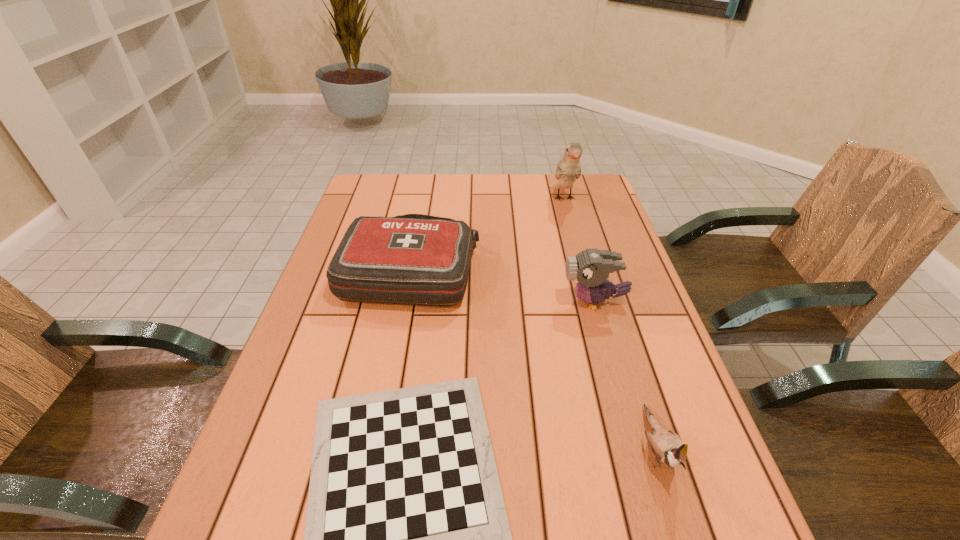
Identify the location of free space located 0.400m on the right of the first-aid kit. The width and height of the screenshot is (960, 540). (626, 268).

Where is `free spot located at the face of the shortest bird`? The height and width of the screenshot is (540, 960). free spot located at the face of the shortest bird is located at coordinates (681, 526).

At what (x,y) coordinates should I click in order to perform the action: click on object located at the far edge. Please return your answer as a coordinate pair (x, y). This screenshot has width=960, height=540. Looking at the image, I should click on (568, 169).

You are a GUI agent. You are given a task and a screenshot of the screen. Output one action in this format:
    pyautogui.click(x=<x>, y=<y>)
    Task: Click on the object that is at the left edge
    
    Given the screenshot: What is the action you would take?
    pyautogui.click(x=414, y=259)

Where is `object at the far right corner`? The width and height of the screenshot is (960, 540). object at the far right corner is located at coordinates (568, 169).

Identify the location of vacant space at the far edge. (477, 195).

I want to click on free space at the right edge, so click(x=690, y=422).

Locate an element on the screen. This screenshot has height=540, width=960. vacant area at the far left corner of the desktop is located at coordinates (371, 200).

In the image, there is a desktop. Identify the location of vacant space at the far right corner. (586, 192).

Identify the location of vacant point located between the nearest bird and the second tallest object. [x=625, y=374].